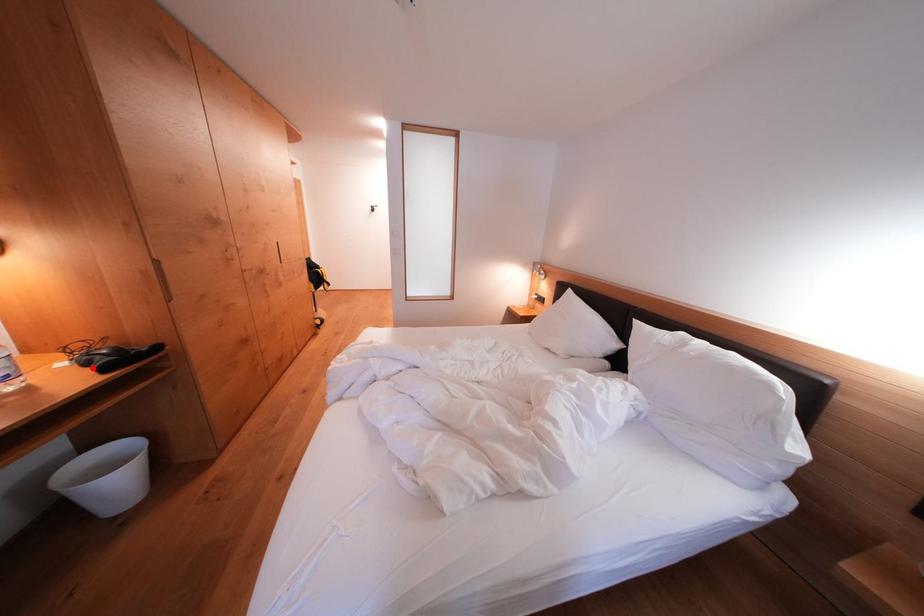
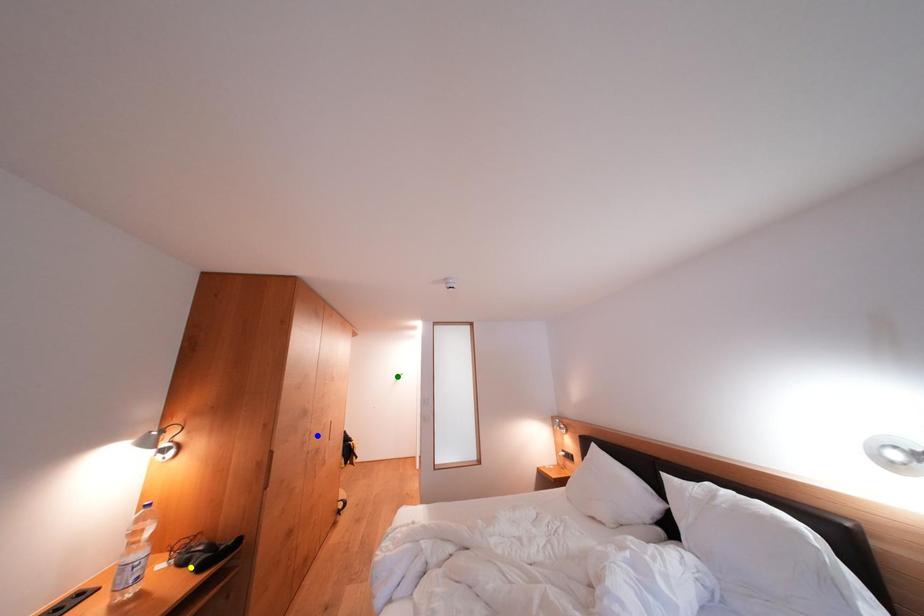
Question: I am providing you with two images of the same scene from different viewpoints. A red point is marked on the first image. You are given multiple points on the second image. Which point in image 2 represents the same 3d spot as the red point in image 1?

Choices:
 (A) yellow point
 (B) green point
 (C) blue point

Answer: (A)